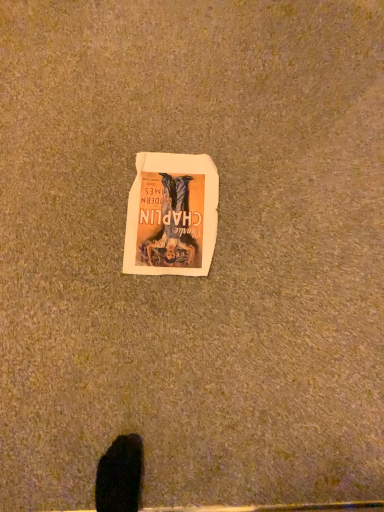
Question: Should I look upward or downward to see matte paper poster at center?

Choices:
 (A) down
 (B) up

Answer: (B)